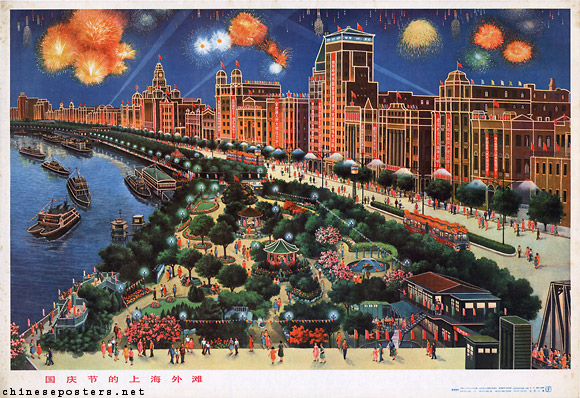
The image size is (580, 398). I want to click on stairs, so click(x=61, y=313), click(x=114, y=285), click(x=420, y=321).